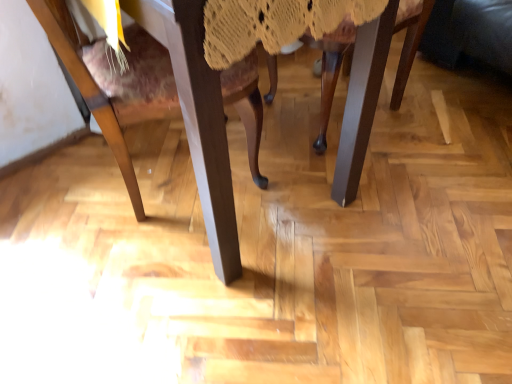
Question: From a real-world perspective, relative to wooden chair leg at center, the second chair positioned from the left, is wooden chair at center, the second chair positioned from the right, vertically above or below?

Choices:
 (A) above
 (B) below

Answer: (A)

Question: Which is correct: wooden chair at center, the 1th chair when ordered from left to right, is inside wooden chair leg at center, the second chair positioned from the left, or outside of it?

Choices:
 (A) inside
 (B) outside

Answer: (B)

Question: Is point (x=66, y=46) positioned closer to the camera than point (x=401, y=6)?

Choices:
 (A) closer
 (B) farther

Answer: (A)

Question: Considering their positions, is wooden chair leg at center, the second chair positioned from the left, located in front of or behind wooden chair at center, the second chair positioned from the right?

Choices:
 (A) behind
 (B) front

Answer: (A)

Question: From a real-world perspective, is wooden chair leg at center, the second chair positioned from the left, above or below wooden chair at center, the 1th chair when ordered from left to right?

Choices:
 (A) above
 (B) below

Answer: (B)

Question: From the image's perspective, is wooden chair leg at center, which appears as the 1th chair when viewed from the right, located above or below wooden chair at center, the second chair positioned from the right?

Choices:
 (A) above
 (B) below

Answer: (A)

Question: Is wooden chair leg at center, the second chair positioned from the left, wider or thinner than wooden chair at center, the second chair positioned from the right?

Choices:
 (A) thin
 (B) wide

Answer: (A)